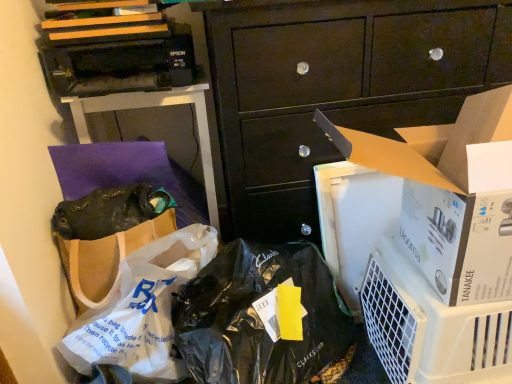
Question: Based on their positions, is white plastic bag at lower left located to the left or right of white plastic air purifier at lower right?

Choices:
 (A) right
 (B) left

Answer: (B)

Question: Is white plastic bag at lower left wider or thinner than white plastic air purifier at lower right?

Choices:
 (A) wide
 (B) thin

Answer: (B)

Question: Estimate the real-world distances between objects in this image. Which object is farther from the white cardboard box at center-right?

Choices:
 (A) dark wood cabinet at center
 (B) white plastic air purifier at lower right
 (C) white plastic bag at lower left
 (D) brown paper bag at upper left
 (E) matte black handbag at center-left

Answer: (D)

Question: Considering the real-world distances, which object is farthest from the matte black handbag at center-left?

Choices:
 (A) white plastic air purifier at lower right
 (B) dark wood cabinet at center
 (C) brown paper bag at upper left
 (D) white cardboard box at center-right
 (E) white plastic bag at lower left

Answer: (A)